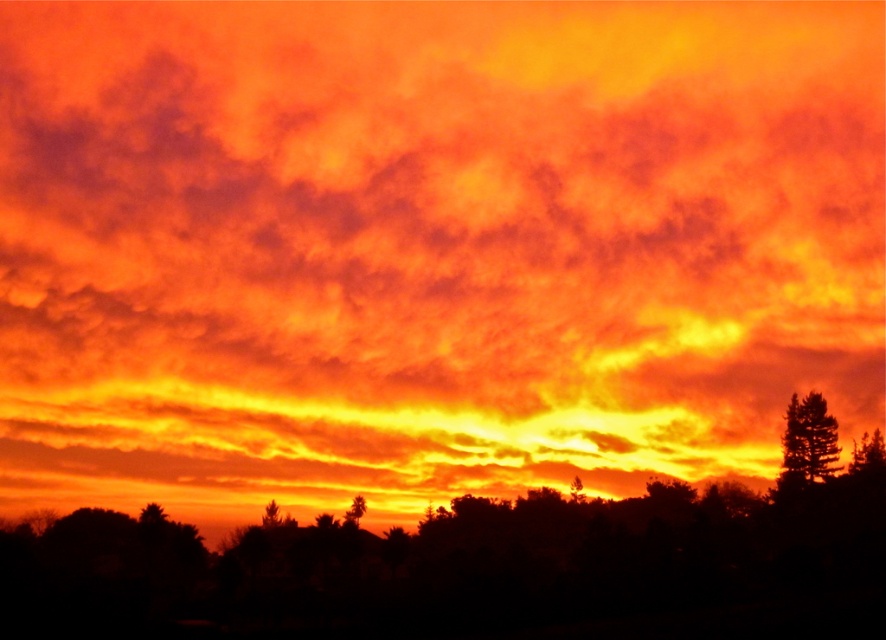
Based on the scene description, which tree, the silky brown pine tree at right or the green leafy tree at center, appears taller in the image?

The silky brown pine tree at right is much taller than the green leafy tree at center.

You are an artist trying to paint the sunset scene. You want to place the silhouette tree at center and the silky brown pine tree at right in your painting. According to the scene, which tree should you draw first if you start from the left side of your canvas?

The silhouette tree at center should be drawn first because it is positioned to the left of the silky brown pine tree at right, so starting from the left side of the canvas, you would encounter the silhouette tree at center before the silky brown pine tree at right.

You are an artist sketching the sunset scene. You want to ensure the silky brown pine tree at right and the silhouette tree at lower center are proportionally accurate. Which tree should you draw larger?

The silky brown pine tree at right should be drawn larger because it has a larger size compared to the silhouette tree at lower center according to the description.